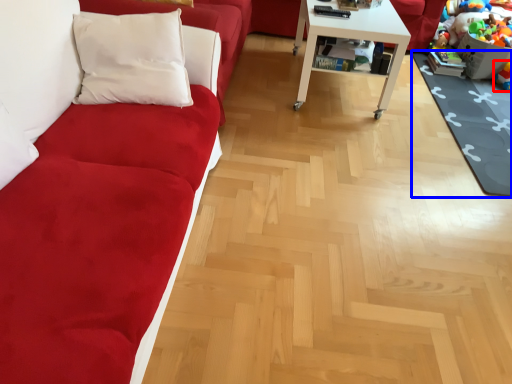
Question: Which object is further to the camera taking this photo, toy (highlighted by a red box) or mat (highlighted by a blue box)?

Choices:
 (A) toy
 (B) mat

Answer: (A)